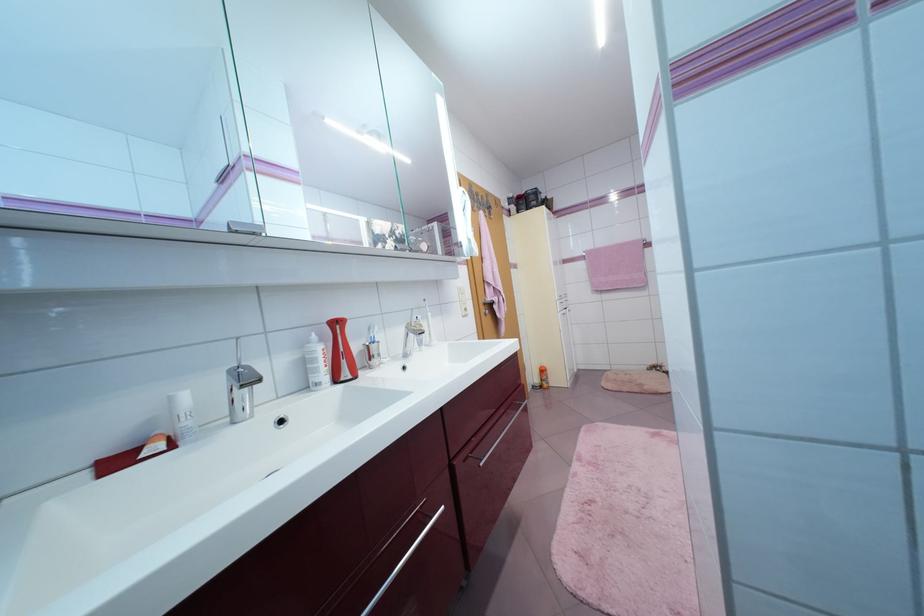
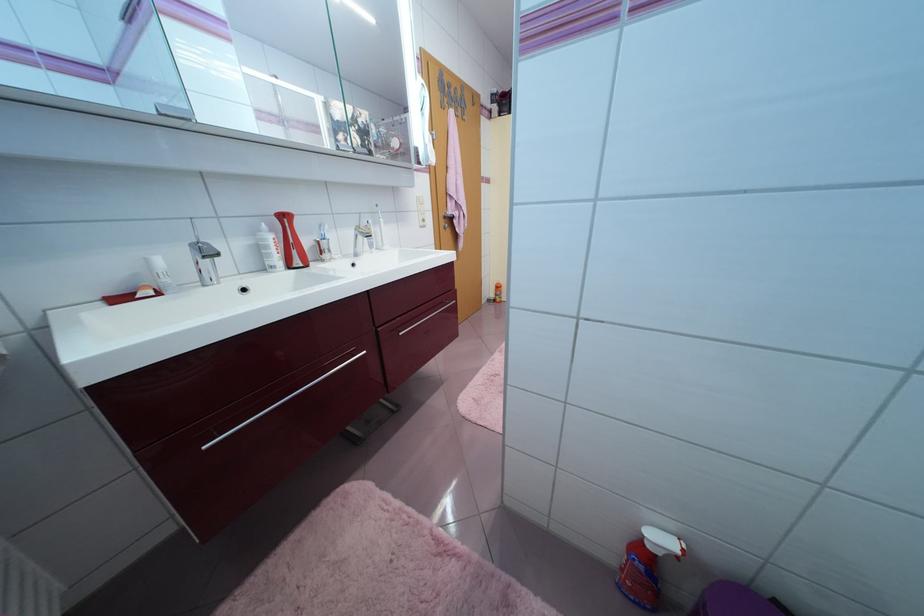
Where in the second image is the point corresponding to point 143,451 from the first image?

(140, 294)